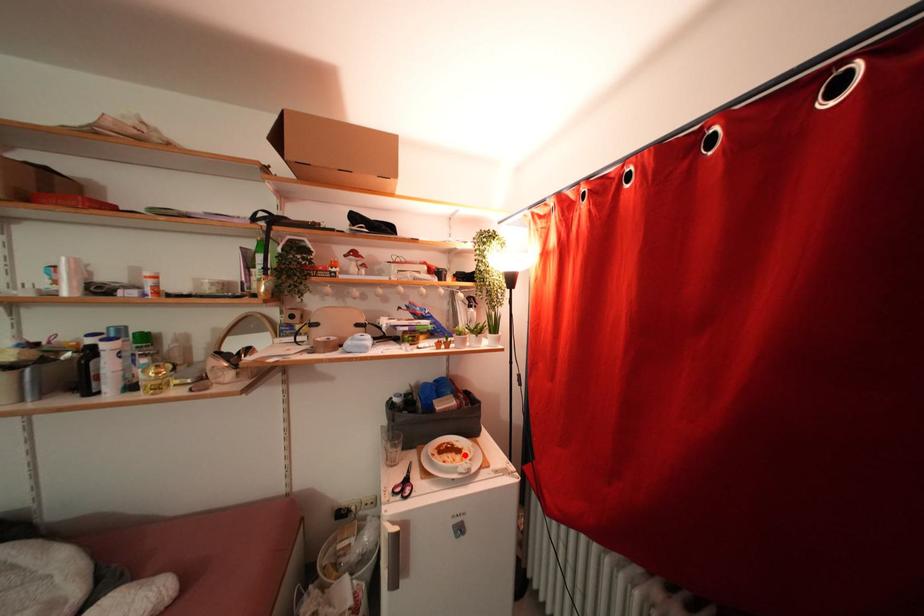
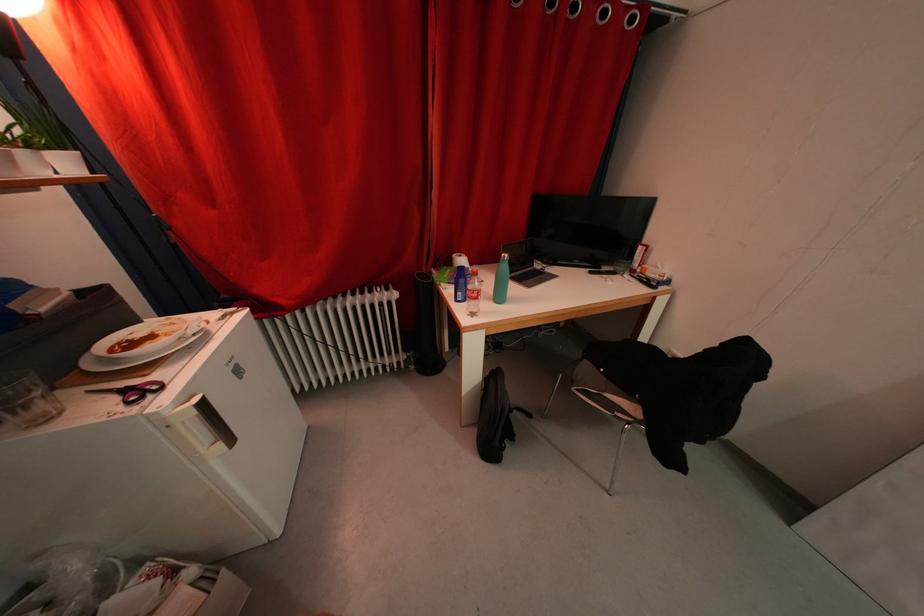
The point at the highlighted location is marked in the first image. Where is the corresponding point in the second image?

(157, 341)